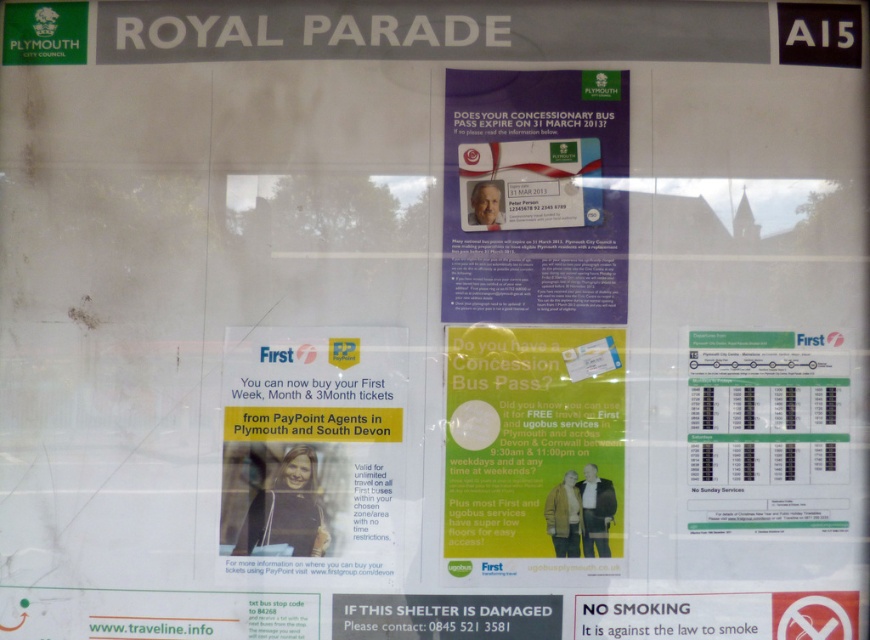
Question: Where is matte yellow paper at center located in relation to green paper poster at center in the image?

Choices:
 (A) right
 (B) left

Answer: (B)

Question: Which point is closer to the camera taking this photo?

Choices:
 (A) (576, 486)
 (B) (550, 176)
 (C) (346, 554)

Answer: (C)

Question: Which point is closer to the camera?

Choices:
 (A) blue paper poster at center
 (B) matte yellow paper at center
 (C) green paper poster at center

Answer: (B)

Question: Can you confirm if blue paper poster at center is positioned to the left of matte yellow paper at center?

Choices:
 (A) yes
 (B) no

Answer: (B)

Question: Is blue paper poster at center in front of matte yellow paper at center?

Choices:
 (A) no
 (B) yes

Answer: (A)

Question: Which is nearer to the matte yellow paper at center?

Choices:
 (A) blue paper poster at center
 (B) green paper poster at center

Answer: (B)